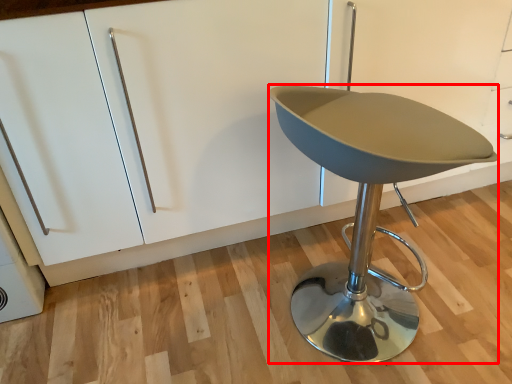
Question: From the image's perspective, what is the correct spatial positioning of furniture (annotated by the red box) in reference to cabinetry?

Choices:
 (A) below
 (B) above

Answer: (A)